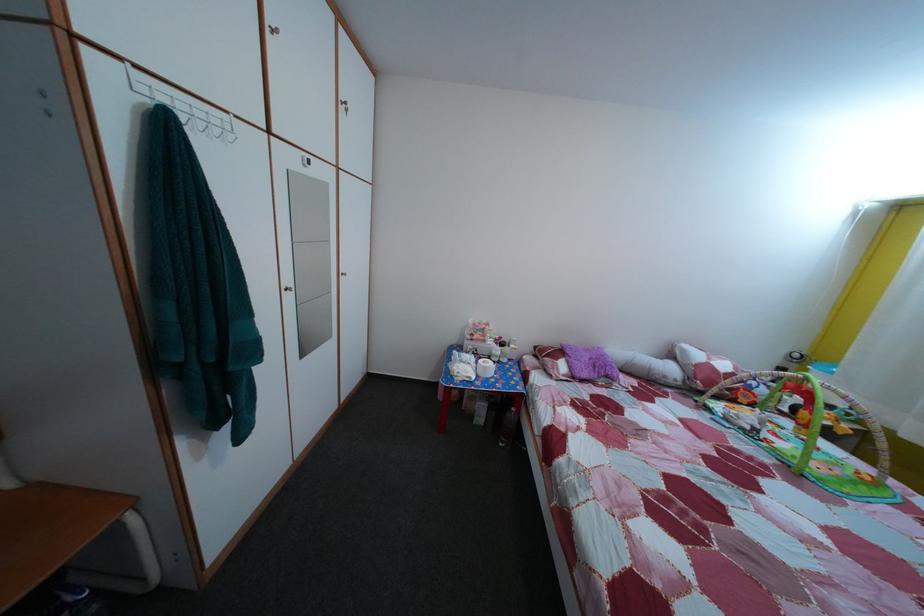
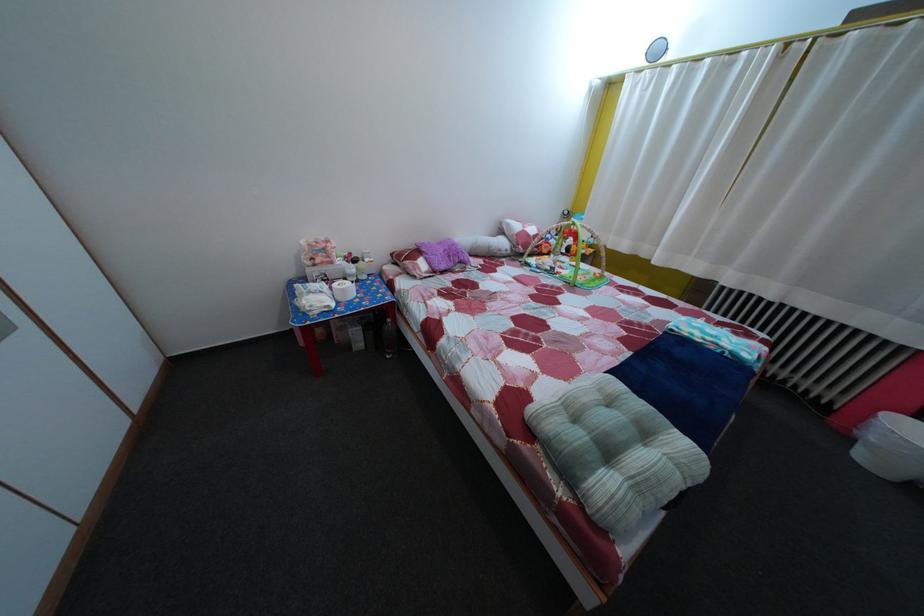
First-person continuous shooting, in which direction is the camera rotating?

The rotation direction of the camera is right-down.